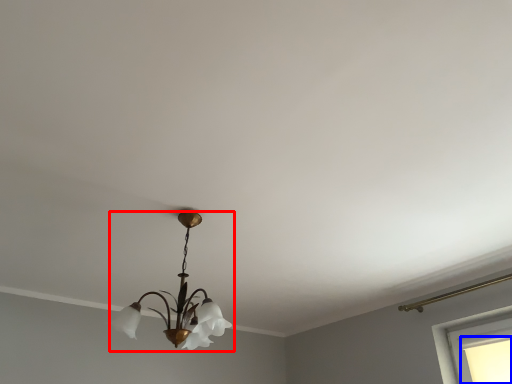
Question: Which point is closer to the camera, lamp (highlighted by a red box) or window (highlighted by a blue box)?

Choices:
 (A) lamp
 (B) window

Answer: (A)